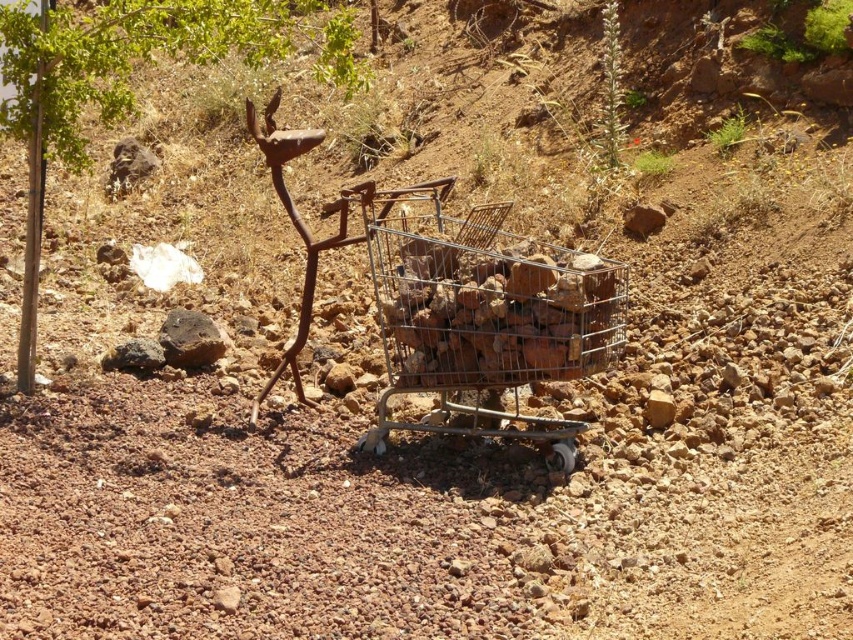
This screenshot has height=640, width=853. What do you see at coordinates (492, 307) in the screenshot?
I see `metallic wire crate at center` at bounding box center [492, 307].

Is metallic wire crate at center below green leafy tree at upper left?

Indeed, metallic wire crate at center is positioned under green leafy tree at upper left.

Is point (552, 304) positioned in front of point (33, 280)?

Yes, it is in front of point (33, 280).

What are the coordinates of `metallic wire crate at center` in the screenshot? It's located at (492, 307).

Looking at this image, is rusty metal shopping cart at center thinner than metallic wire crate at center?

In fact, rusty metal shopping cart at center might be wider than metallic wire crate at center.

Who is more distant from viewer, (x=572, y=259) or (x=546, y=333)?

Point (x=572, y=259)

Which is in front, point (344, 221) or point (404, 225)?

Point (344, 221)

Identify the location of rusty metal shopping cart at center. The width and height of the screenshot is (853, 640). (461, 305).

Is point (293, 342) closer to viewer compared to point (71, 42)?

No, it is behind (71, 42).

Can you confirm if rusty metal shopping cart at center is wider than green leafy tree at upper left?

Indeed, rusty metal shopping cart at center has a greater width compared to green leafy tree at upper left.

This screenshot has width=853, height=640. Describe the element at coordinates (461, 305) in the screenshot. I see `rusty metal shopping cart at center` at that location.

Image resolution: width=853 pixels, height=640 pixels. Identify the location of rusty metal shopping cart at center. (461, 305).